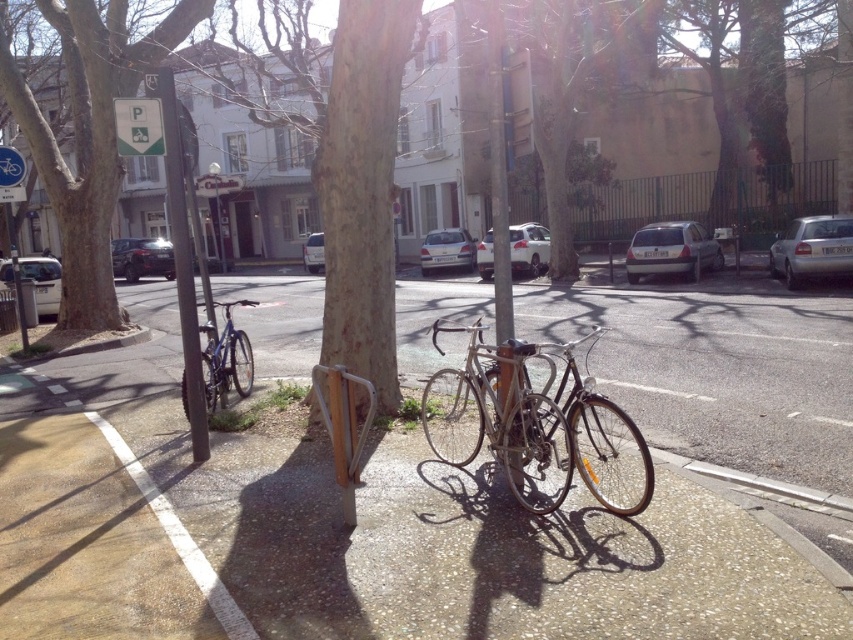
Question: Is shiny silver bicycle at center to the right of white matte car at left from the viewer's perspective?

Choices:
 (A) yes
 (B) no

Answer: (A)

Question: Which point is farther to the camera?

Choices:
 (A) (222, 353)
 (B) (244, 465)
 (C) (509, 284)
 (D) (461, 259)

Answer: (D)

Question: Estimate the real-world distances between objects in this image. Which object is closer to the matte black car at left?

Choices:
 (A) brown rough tree at upper left
 (B) silver metallic sedan at center
 (C) metallic pole at left
 (D) green plastic parking sign at upper left

Answer: (B)

Question: Which of the following is the closest to the observer?

Choices:
 (A) white matte car at center
 (B) silver metallic sedan at center

Answer: (A)

Question: Does silver metallic bicycle at center appear on the left side of shiny silver bicycle at center?

Choices:
 (A) yes
 (B) no

Answer: (A)

Question: Can you confirm if blue metallic bicycle at left is smaller than green plastic parking sign at upper left?

Choices:
 (A) no
 (B) yes

Answer: (A)